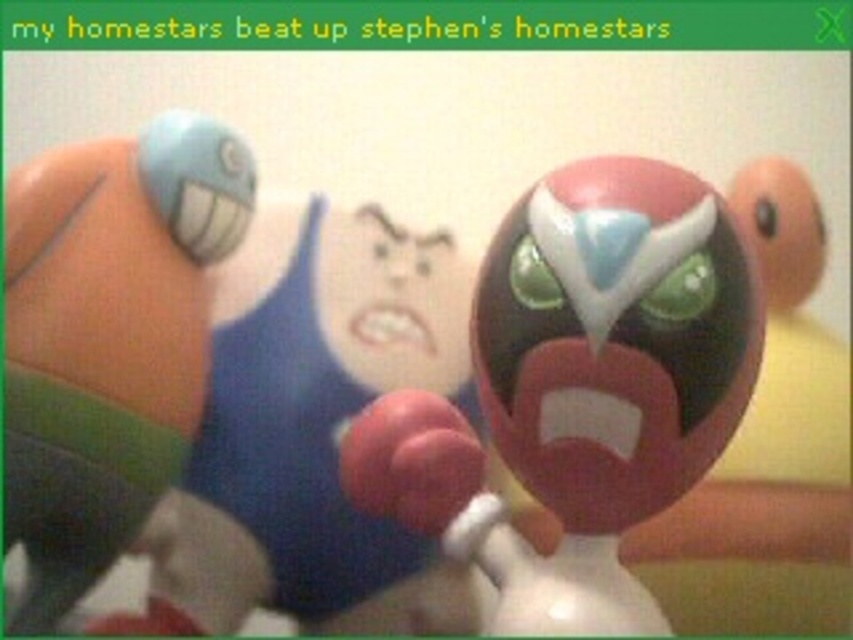
Question: Is shiny plastic toy at center closer to the viewer compared to matte plastic toy at left?

Choices:
 (A) no
 (B) yes

Answer: (B)

Question: Which point is farther to the camera?

Choices:
 (A) matte plastic toy at left
 (B) shiny plastic toy at center

Answer: (A)

Question: Does shiny plastic toy at center have a larger size compared to matte plastic toy at left?

Choices:
 (A) yes
 (B) no

Answer: (B)

Question: Observing the image, what is the correct spatial positioning of shiny plastic toy at center in reference to matte plastic toy at left?

Choices:
 (A) left
 (B) right

Answer: (B)

Question: Which point is closer to the camera?

Choices:
 (A) shiny plastic toy at center
 (B) matte plastic toy at left

Answer: (A)